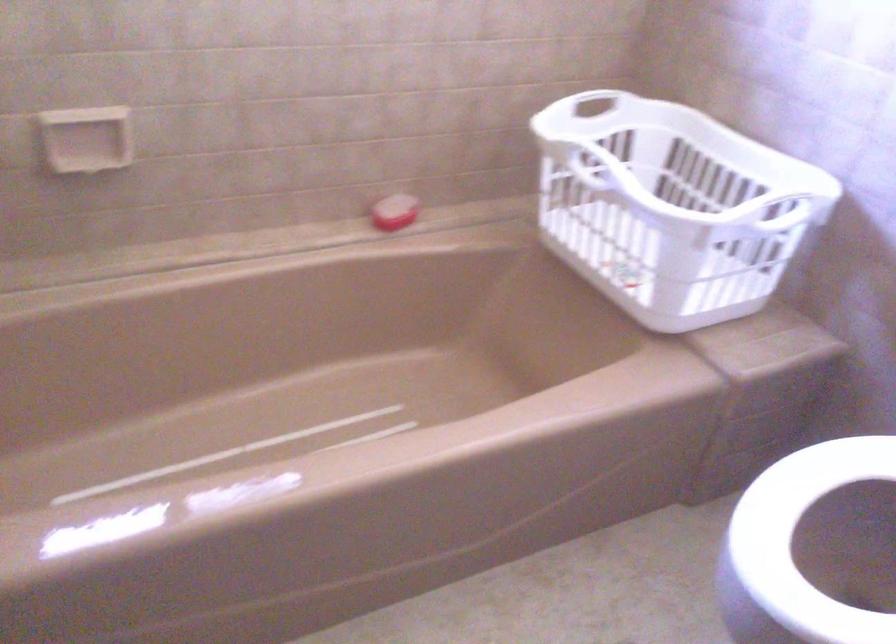
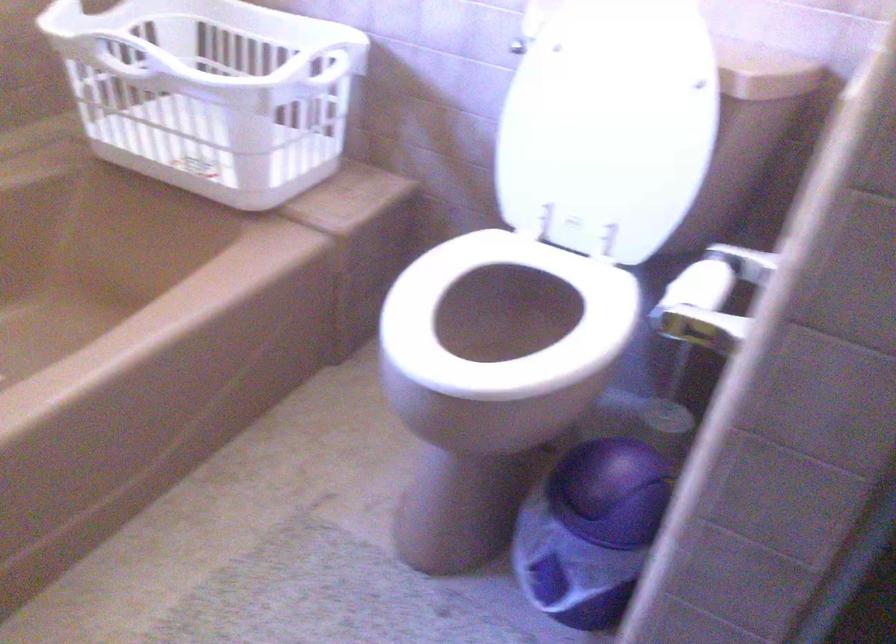
Question: How did the camera likely rotate?

Choices:
 (A) Left
 (B) Right
 (C) Up
 (D) Down

Answer: (B)